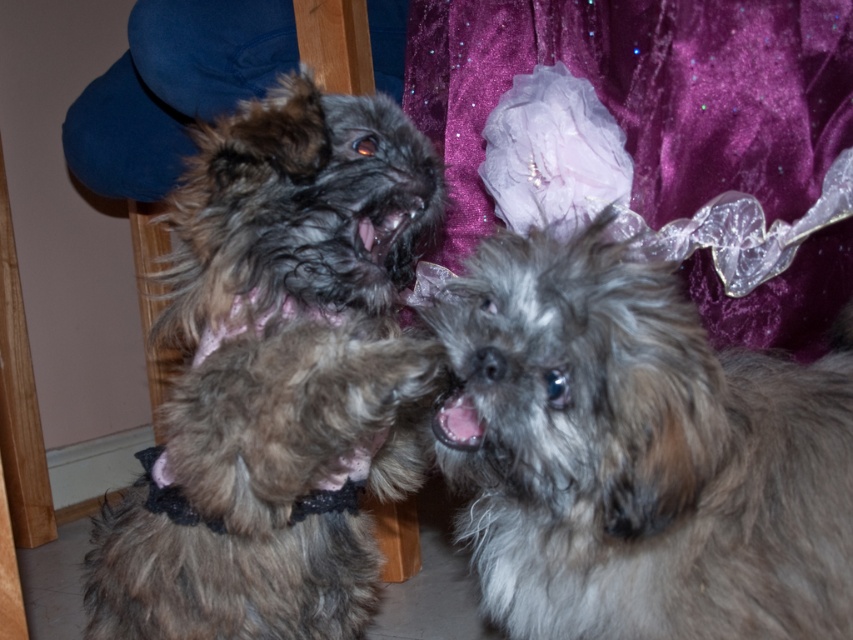
You are a photographer trying to capture a clear shot of the fuzzy gray dog at center and the fuzzy brown fur at center. Which dog should you focus on first to ensure the background stays sharp?

The fuzzy gray dog at center is in front of the fuzzy brown fur at center, so you should focus on the fuzzy gray dog at center first to keep the background sharp.

You are a dog groomer assessing two dogs for a grooming session. You notice the fuzzy gray dog at center and the fuzzy brown fur at center. Which dog has a more slender body shape?

The fuzzy gray dog at center is thinner than the fuzzy brown fur at center, so the fuzzy gray dog at center has a more slender body shape.

You are holding a 12 inch long stick. You want to throw it to the point marked as point (799, 628). Can you reach it with your throw?

The point (799, 628) is 27.18 inches from the camera, so the 12 inch long stick cannot reach it as it is too far away.